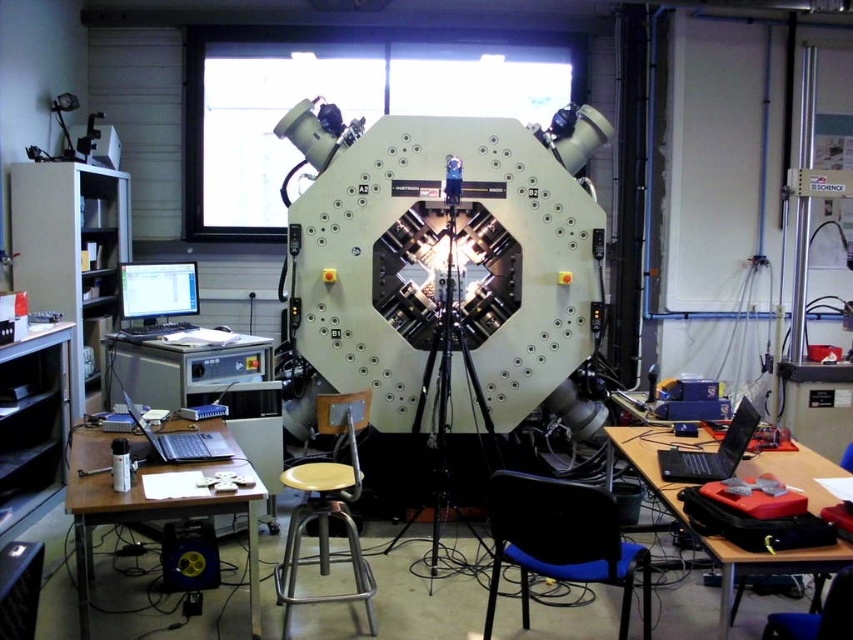
You are a researcher in the lab. You need to reach the point labeled as point (x=582, y=499) first and then the point (x=352, y=454). Which point is closer to your starting position if you are standing at the desk with the laptop?

Point (x=582, y=499) is closer to your starting position because it is in front of point (x=352, y=454).

You are a researcher who needs to sit down to monitor the scanning electron microscope. You see a blue fabric chair at center and a yellow matte stool at center. Which seat would you choose if you prefer a more spacious seating option?

The blue fabric chair at center is larger in size than the yellow matte stool at center, so you should choose the blue fabric chair at center for a more spacious seating option.